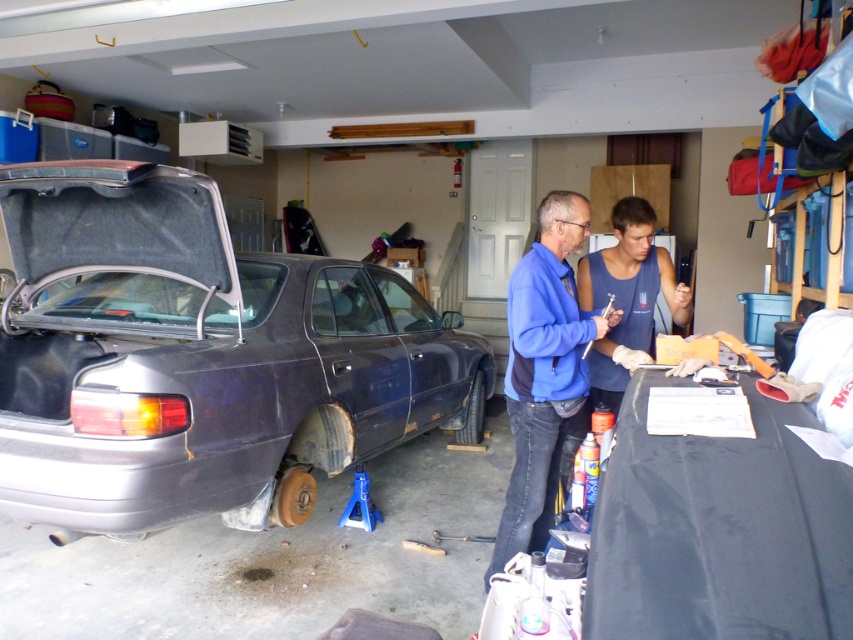
The height and width of the screenshot is (640, 853). Describe the element at coordinates (547, 371) in the screenshot. I see `blue fleece jacket at center` at that location.

Does blue fleece jacket at center have a lesser width compared to blue cotton tank top at center?

In fact, blue fleece jacket at center might be wider than blue cotton tank top at center.

Is point (646, 200) closer to viewer compared to point (653, 236)?

That is False.

Where is `blue fleece jacket at center`? blue fleece jacket at center is located at coordinates (547, 371).

Can you confirm if matte dark gray car at left is positioned to the right of blue fleece jacket at center?

Incorrect, matte dark gray car at left is not on the right side of blue fleece jacket at center.

What do you see at coordinates (199, 356) in the screenshot? I see `matte dark gray car at left` at bounding box center [199, 356].

Identify the location of matte dark gray car at left. The width and height of the screenshot is (853, 640). (199, 356).

Does matte dark gray car at left have a larger size compared to blue cotton tank top at center?

Yes.

At what (x,y) coordinates should I click in order to perform the action: click on matte dark gray car at left. Please return your answer as a coordinate pair (x, y). Looking at the image, I should click on (199, 356).

Find the location of a particular element. matte dark gray car at left is located at coordinates (199, 356).